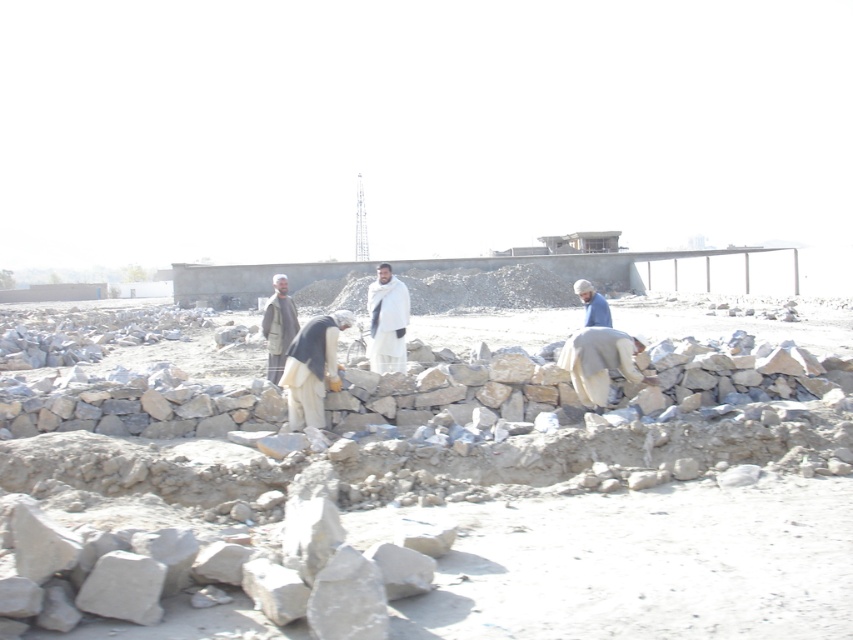
Question: Does dark gray fabric construction worker at center appear under light brown fabric jacket at center?

Choices:
 (A) no
 (B) yes

Answer: (A)

Question: Is gray stone wall at center wider than white woolen shawl at center?

Choices:
 (A) yes
 (B) no

Answer: (A)

Question: Is dark gray fabric construction worker at center to the left of light brown fabric jacket at center from the viewer's perspective?

Choices:
 (A) yes
 (B) no

Answer: (A)

Question: Which of the following is the closest to the observer?

Choices:
 (A) (315, 388)
 (B) (822, 513)

Answer: (B)

Question: Estimate the real-world distances between objects in this image. Which object is closer to the dark gray fabric construction worker at center?

Choices:
 (A) gray stone wall at center
 (B) white woolen shawl at center
 (C) blue fabric construction worker at right

Answer: (B)

Question: Which point is farther to the camera?

Choices:
 (A) (279, 275)
 (B) (273, 536)

Answer: (A)